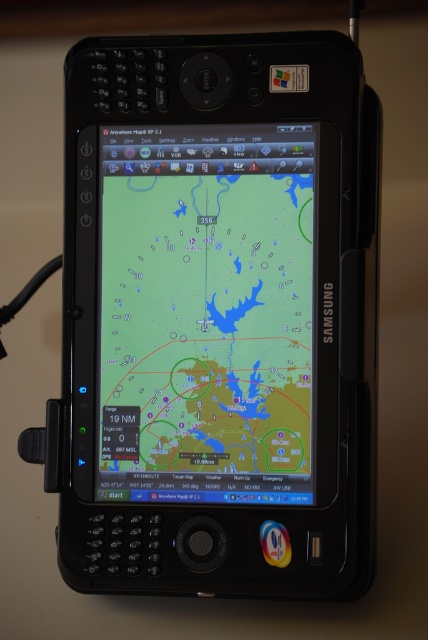
Does black plastic smartphone at center have a lesser height compared to matte screen map at center?

No, black plastic smartphone at center is not shorter than matte screen map at center.

The image size is (428, 640). What are the coordinates of `black plastic smartphone at center` in the screenshot? It's located at (219, 316).

In order to click on black plastic smartphone at center in this screenshot , I will do `click(219, 316)`.